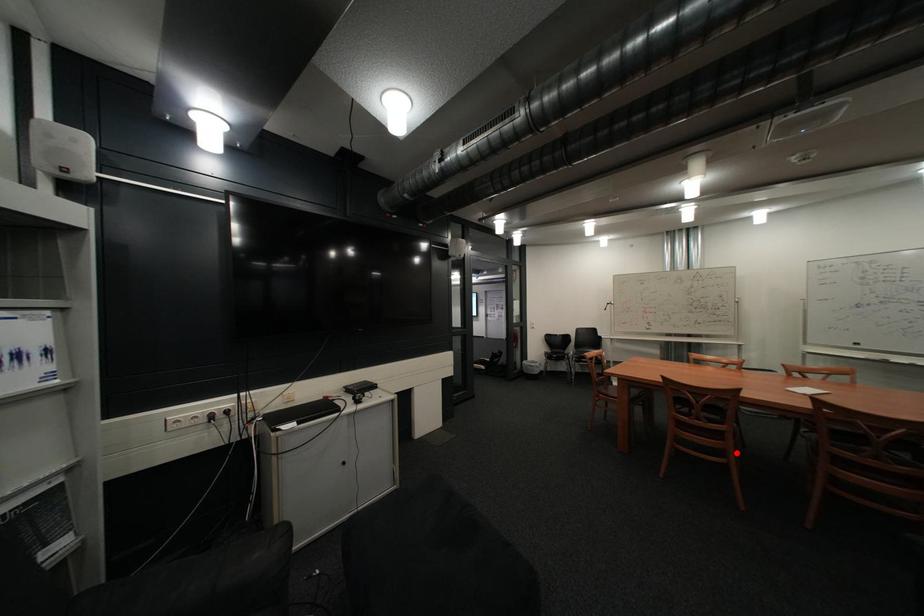
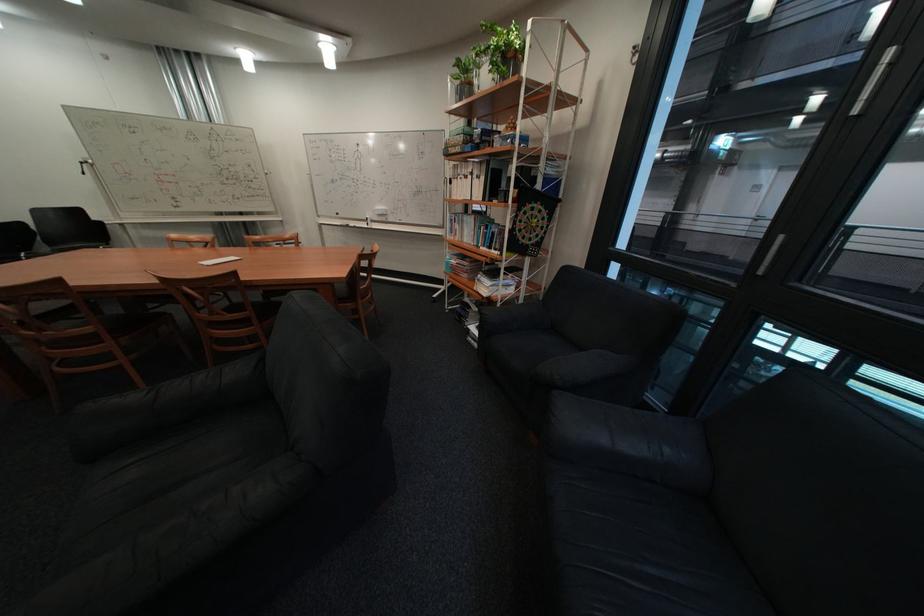
Question: I am providing you with two images of the same scene from different viewpoints. Image1 has a red point marked. In image2, the corresponding 3D location appears at what relative position? Reply with the corresponding letter.

Choices:
 (A) Closer
 (B) Farther

Answer: (A)